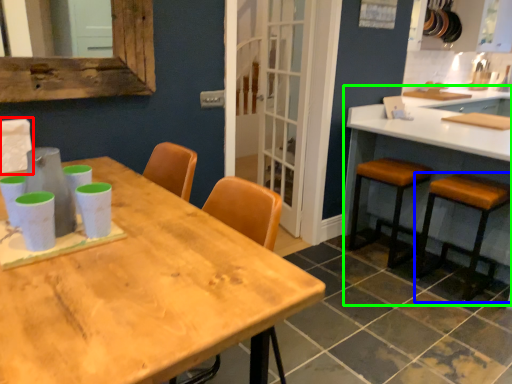
Question: Considering the real-world distances, which object is farthest from chair (highlighted by a red box)? stool (highlighted by a blue box) or counter (highlighted by a green box)?

Choices:
 (A) stool
 (B) counter

Answer: (B)